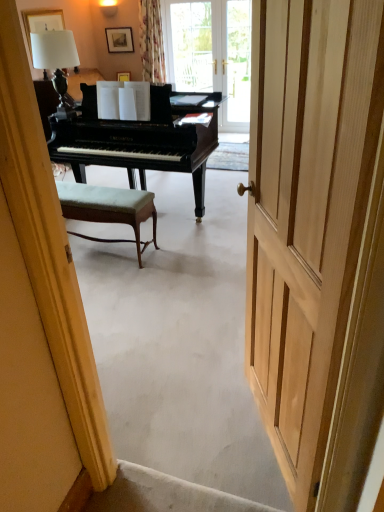
Where is `vacant space to the right of green fabric bench at center`? The height and width of the screenshot is (512, 384). vacant space to the right of green fabric bench at center is located at coordinates (171, 244).